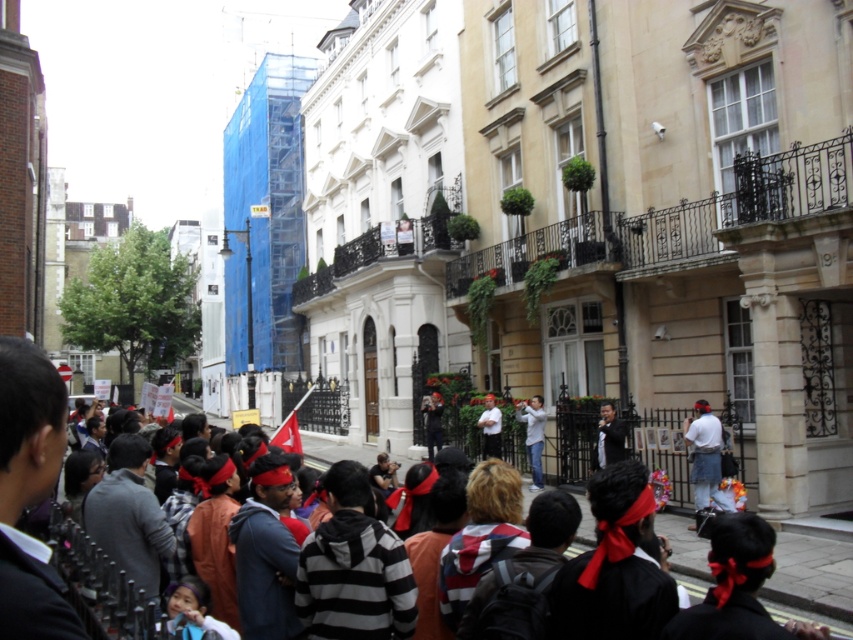
Can you confirm if black leather jacket at center is positioned to the left of white shirt at center?

In fact, black leather jacket at center is to the right of white shirt at center.

Describe the element at coordinates (608, 436) in the screenshot. Image resolution: width=853 pixels, height=640 pixels. I see `black leather jacket at center` at that location.

Image resolution: width=853 pixels, height=640 pixels. I want to click on black leather jacket at center, so click(608, 436).

Who is taller, white matte shirt at center or matte black camera at center?

matte black camera at center

Is white matte shirt at center below matte black camera at center?

Incorrect, white matte shirt at center is not positioned below matte black camera at center.

Who is more distant from viewer, (532, 435) or (440, 436)?

Point (440, 436)

I want to click on white matte shirt at center, so click(x=532, y=435).

Between white matte shirt at center and white shirt at center, which one appears on the left side from the viewer's perspective?

white shirt at center

Who is more forward, (538, 410) or (497, 413)?

Point (538, 410)

Locate an element on the screen. Image resolution: width=853 pixels, height=640 pixels. white matte shirt at center is located at coordinates (532, 435).